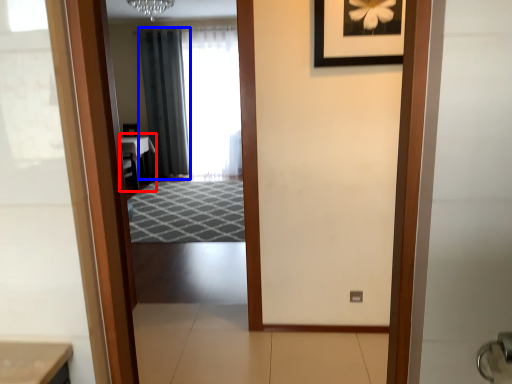
Question: Among these objects, which one is nearest to the camera, table (highlighted by a red box) or curtain (highlighted by a blue box)?

Choices:
 (A) table
 (B) curtain

Answer: (A)